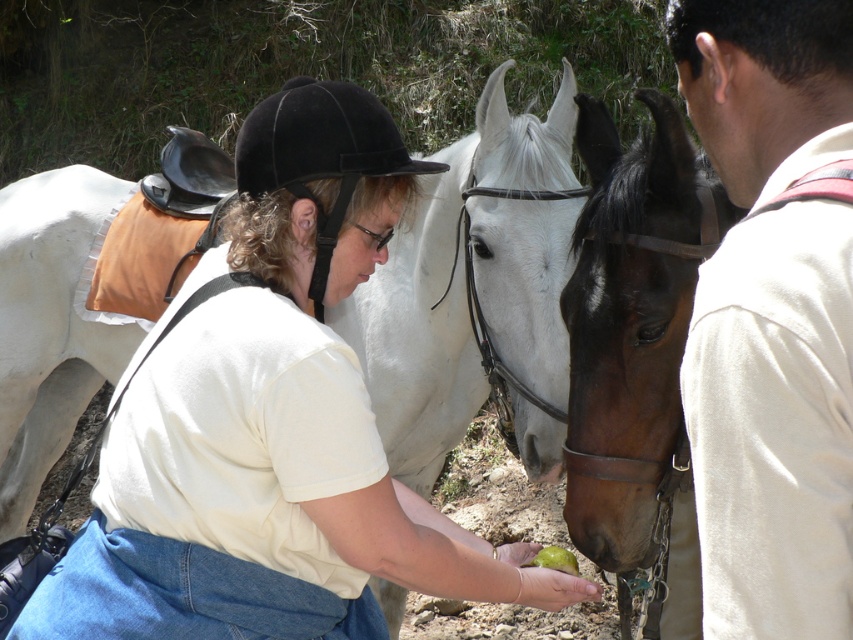
Does white glossy horse at center have a greater height compared to brown leather halter at center?

In fact, white glossy horse at center may be shorter than brown leather halter at center.

Is white glossy horse at center further to camera compared to brown leather halter at center?

No, it is not.

Where is `white glossy horse at center`? This screenshot has width=853, height=640. white glossy horse at center is located at coordinates (260, 467).

Who is positioned more to the left, white cotton shirt at center or brown leather halter at center?

white cotton shirt at center is more to the left.

Which is more to the right, white cotton shirt at center or brown leather halter at center?

brown leather halter at center is more to the right.

Who is more forward, (x=706, y=512) or (x=643, y=456)?

Point (x=706, y=512) is more forward.

You are a GUI agent. You are given a task and a screenshot of the screen. Output one action in this format:
    pyautogui.click(x=<x>, y=<y>)
    Task: Click on the white cotton shirt at center
    This screenshot has width=853, height=640.
    Given the screenshot: What is the action you would take?
    pyautogui.click(x=775, y=424)

Which of these two, white glossy horse at center or white cotton shirt at center, stands shorter?

Standing shorter between the two is white cotton shirt at center.

From the picture: Does white glossy horse at center have a lesser width compared to white cotton shirt at center?

No.

Identify the location of white glossy horse at center. (260, 467).

Locate an element on the screen. The height and width of the screenshot is (640, 853). white glossy horse at center is located at coordinates (260, 467).